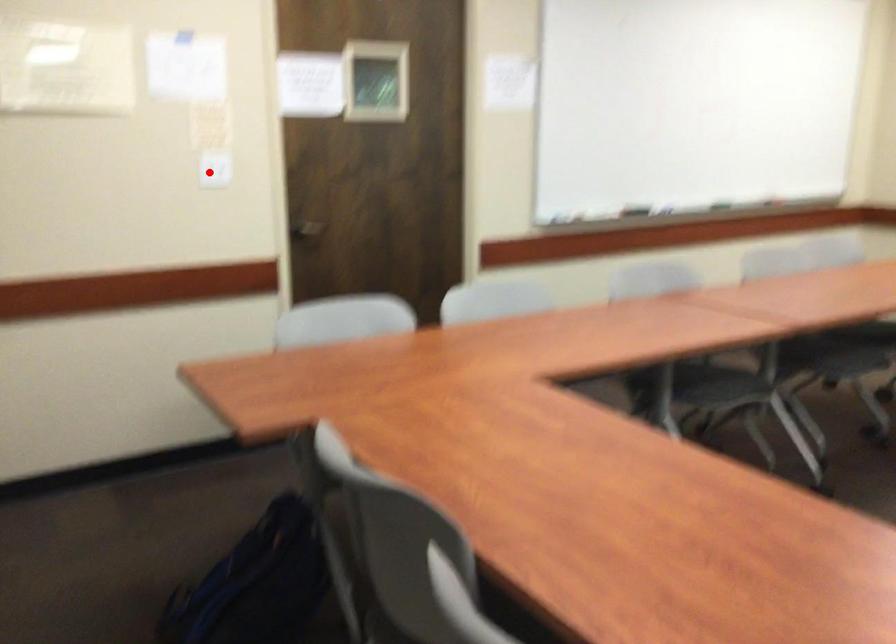
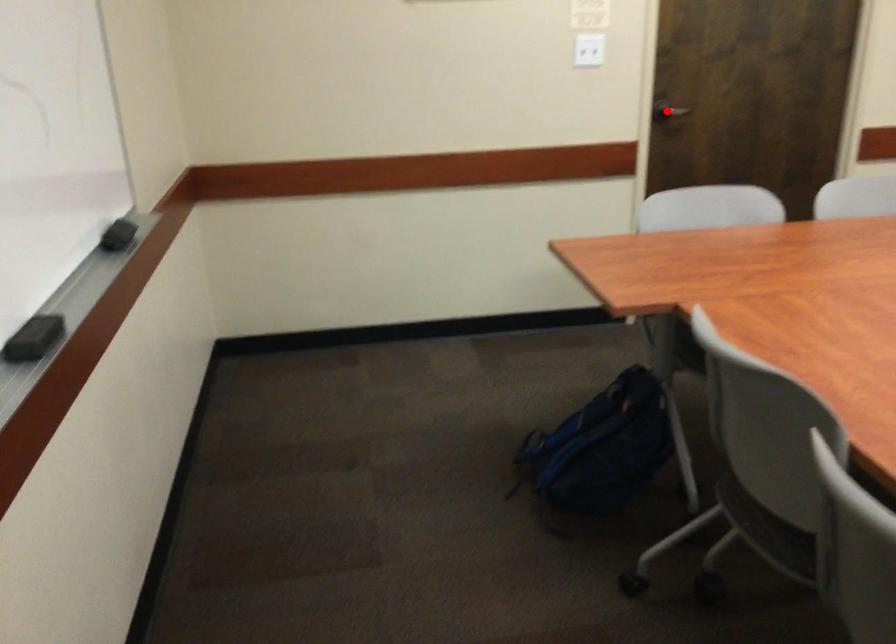
I am providing you with two images of the same scene from different viewpoints. A red point is marked on the first image and another point is marked on the second image. Does the point marked in image1 correspond to the same location as the one in image2?

No